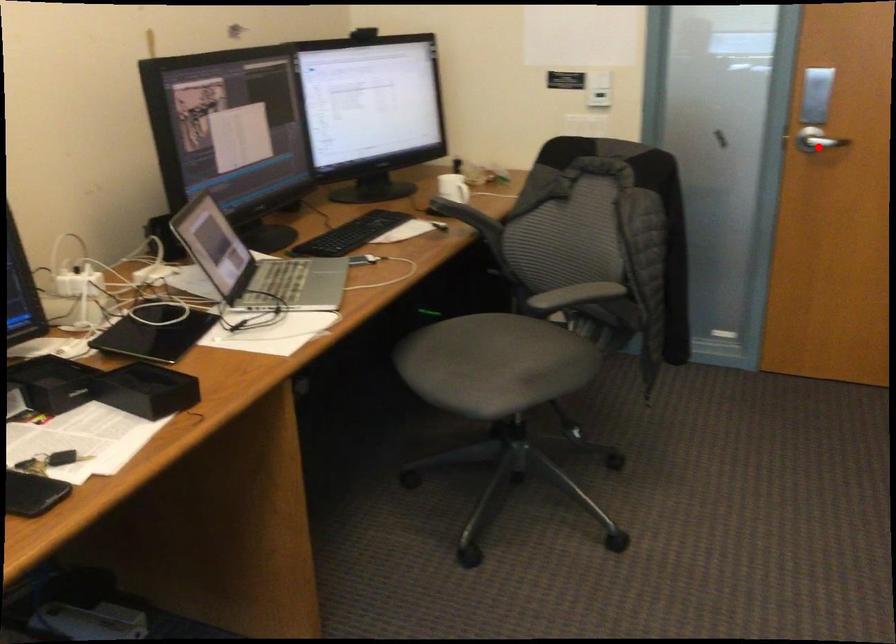
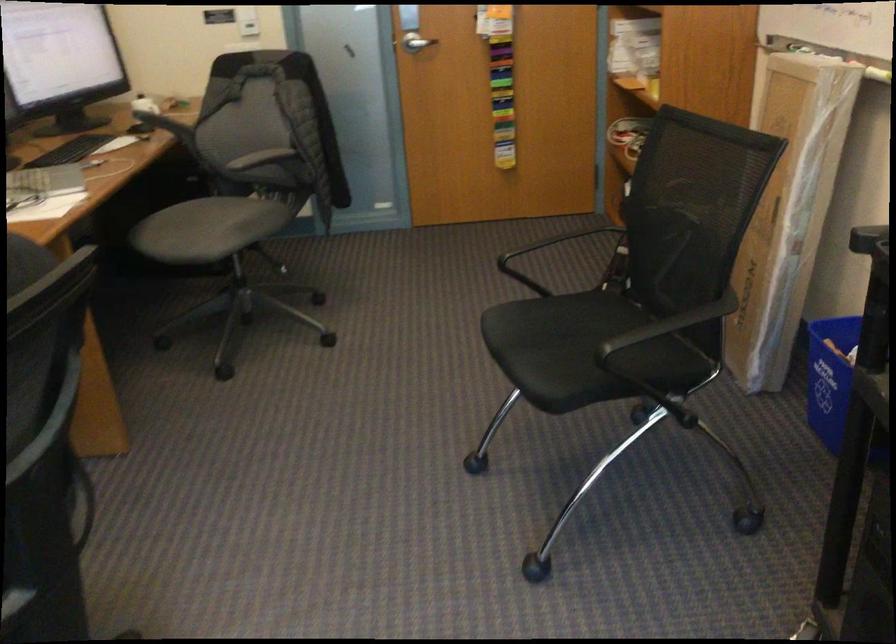
Question: I am providing you with two images of the same scene from different viewpoints. In image1, a red point is highlighted. Considering the same 3D point in image2, which of the following is correct?

Choices:
 (A) It is closer
 (B) It is farther

Answer: (B)